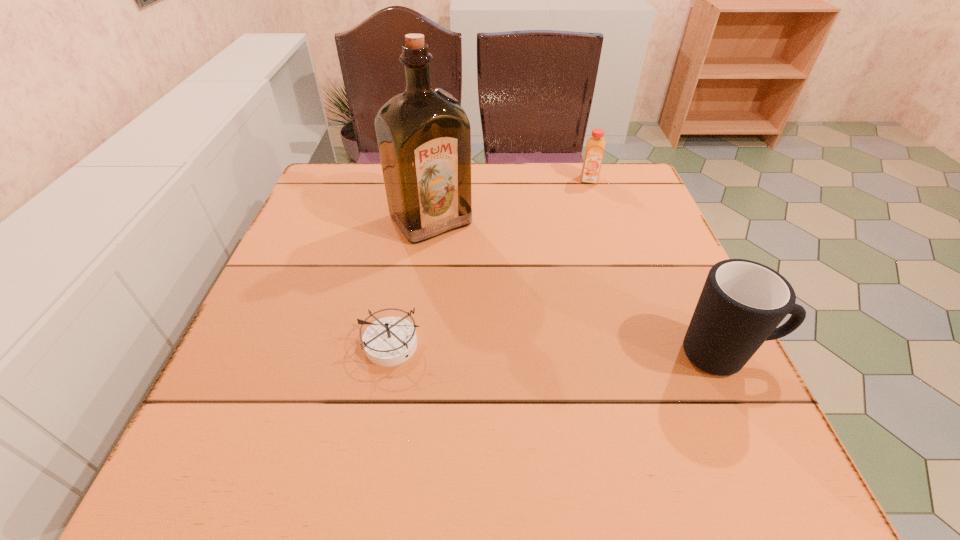
What are the coordinates of `free space in the image that satisfies the following two spatial constraints: 1. on the front side of the third shortest object; 2. on the side of the shortest object with the handle` in the screenshot? It's located at (392, 355).

The height and width of the screenshot is (540, 960). In order to click on vacant space that satisfies the following two spatial constraints: 1. on the front side of the third nearest object; 2. on the side of the mug with the handle in this screenshot , I will do `click(413, 355)`.

You are a GUI agent. You are given a task and a screenshot of the screen. Output one action in this format:
    pyautogui.click(x=<x>, y=<y>)
    Task: Click on the vacant space that satisfies the following two spatial constraints: 1. on the back side of the liquor; 2. on the right side of the third object from left to right
    
    Given the screenshot: What is the action you would take?
    pyautogui.click(x=436, y=179)

The height and width of the screenshot is (540, 960). Identify the location of vacant space that satisfies the following two spatial constraints: 1. on the front side of the rightmost object; 2. on the side of the compass with the handle. (392, 355).